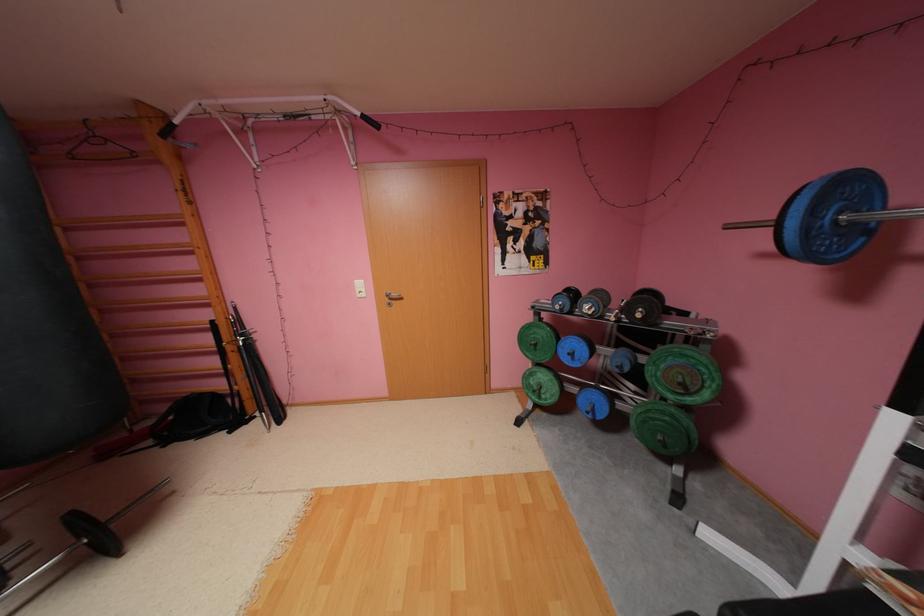
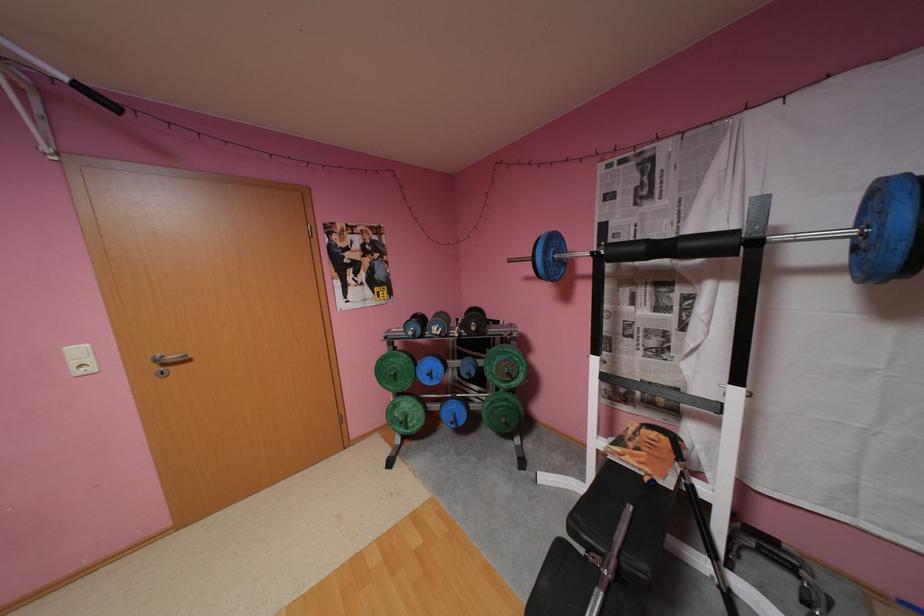
Question: How did the camera likely rotate?

Choices:
 (A) Left
 (B) Right
 (C) Up
 (D) Down

Answer: (B)